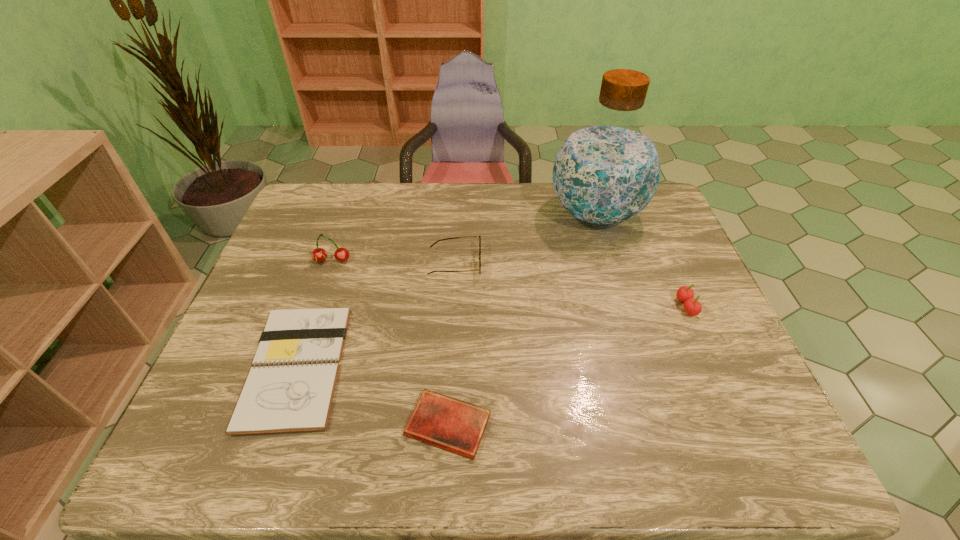
Where is `vacant space situated on the back of the nearer cherry`? This screenshot has height=540, width=960. vacant space situated on the back of the nearer cherry is located at coordinates (652, 228).

At what (x,y) coordinates should I click in order to perform the action: click on blank space located on the face of the spectacles. Please return your answer as a coordinate pair (x, y). Image resolution: width=960 pixels, height=540 pixels. Looking at the image, I should click on (516, 264).

Locate an element on the screen. vacant area situated on the right of the notepad is located at coordinates (516, 366).

The width and height of the screenshot is (960, 540). Identify the location of vacant area situated on the back of the diary. (452, 355).

Image resolution: width=960 pixels, height=540 pixels. I want to click on object at the far edge, so click(x=606, y=172).

Locate an element on the screen. This screenshot has height=540, width=960. notepad positioned at the near edge is located at coordinates (290, 388).

I want to click on diary at the near edge, so click(x=454, y=425).

Find the location of a particular element. cherry that is positioned at the left edge is located at coordinates (319, 255).

Find the location of a particular element. This screenshot has width=960, height=540. notepad at the left edge is located at coordinates (290, 388).

The width and height of the screenshot is (960, 540). I want to click on water jug located at the right edge, so click(606, 172).